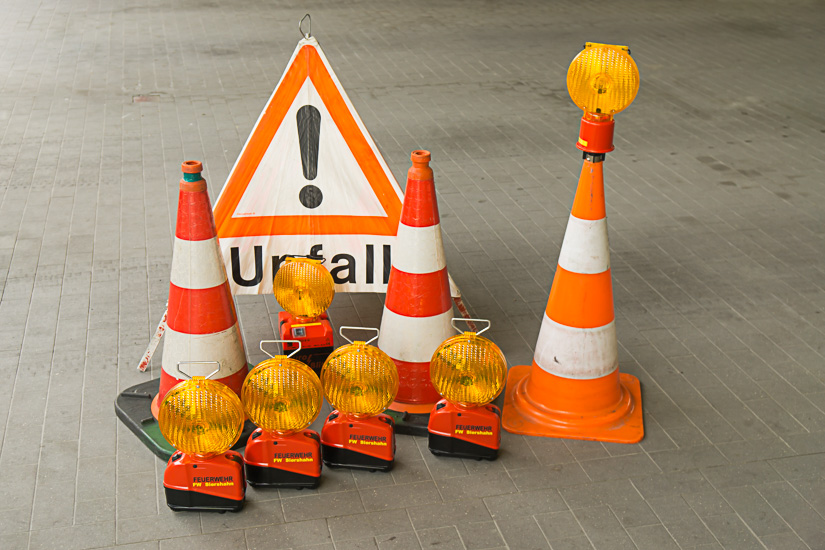
At what (x,y) coordinates should I click in order to perform the action: click on reflector light. Please return your answer as a coordinate pair (x, y). The width and height of the screenshot is (825, 550). Looking at the image, I should click on (211, 409), (277, 385), (347, 387), (451, 372), (309, 304), (588, 66).